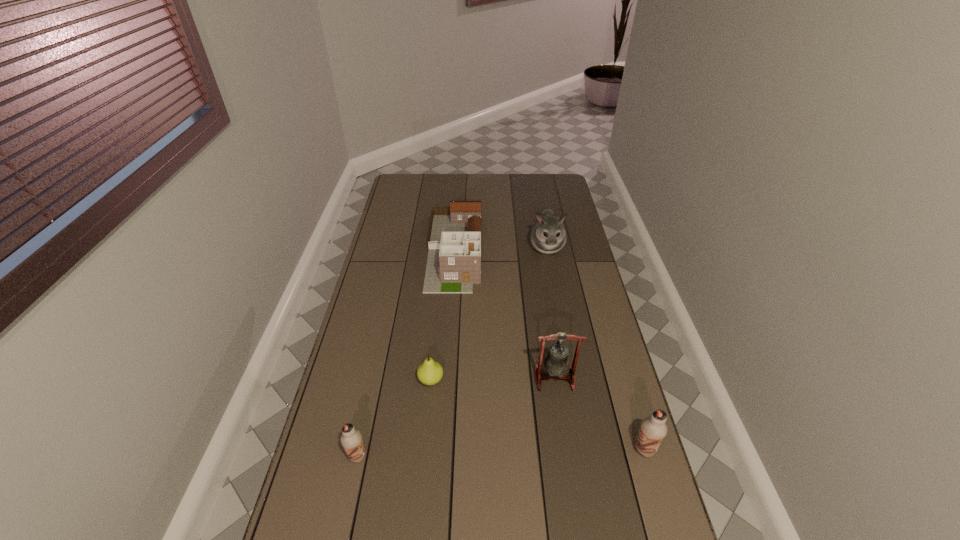
Find the location of `the second shortest object`. the second shortest object is located at coordinates (351, 439).

Locate an element on the screen. The width and height of the screenshot is (960, 540). the shorter chocolate milk is located at coordinates (351, 439).

Identify the location of the rightmost object. (653, 429).

Where is `the right chocolate milk`? The height and width of the screenshot is (540, 960). the right chocolate milk is located at coordinates (653, 429).

The height and width of the screenshot is (540, 960). In order to click on dollhouse in this screenshot , I will do (453, 265).

Find the location of `pear`. pear is located at coordinates (430, 372).

In order to click on bell in this screenshot , I will do `click(556, 364)`.

You are a GUI agent. You are given a task and a screenshot of the screen. Output one action in this format:
    pyautogui.click(x=<x>, y=<y>)
    Task: Click on the hamster
    
    Given the screenshot: What is the action you would take?
    pyautogui.click(x=548, y=235)

At what (x,y) coordinates should I click in order to perform the action: click on free space located 0.360m on the right of the leftmost object. Please return your answer as a coordinate pair (x, y). The image size is (960, 540). Looking at the image, I should click on (498, 456).

Find the location of a particular element. free space located on the front of the taller chocolate milk is located at coordinates (670, 536).